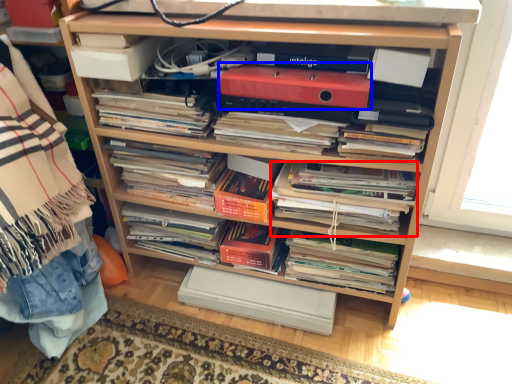
Question: Which object is further to the camera taking this photo, magazine (highlighted by a red box) or paperback book (highlighted by a blue box)?

Choices:
 (A) magazine
 (B) paperback book

Answer: (A)